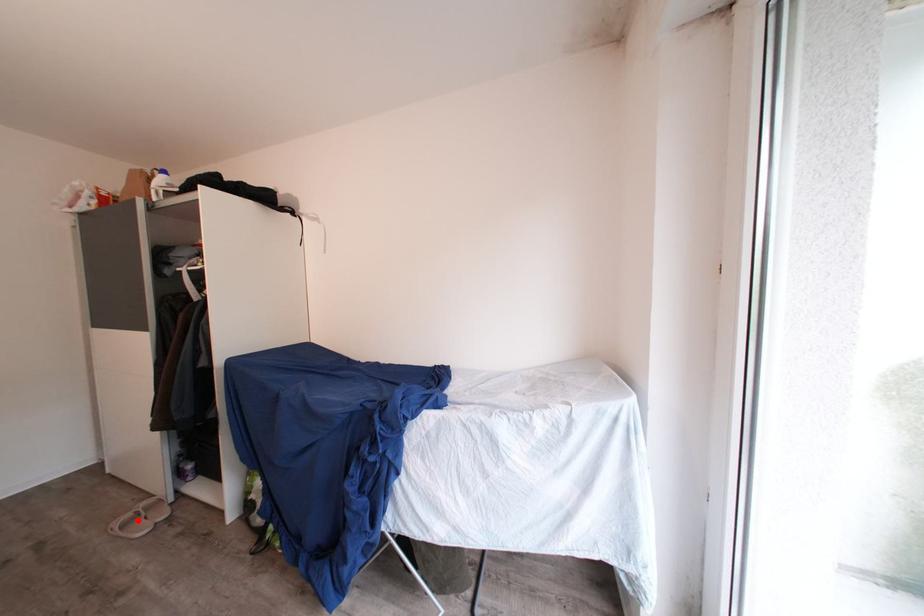
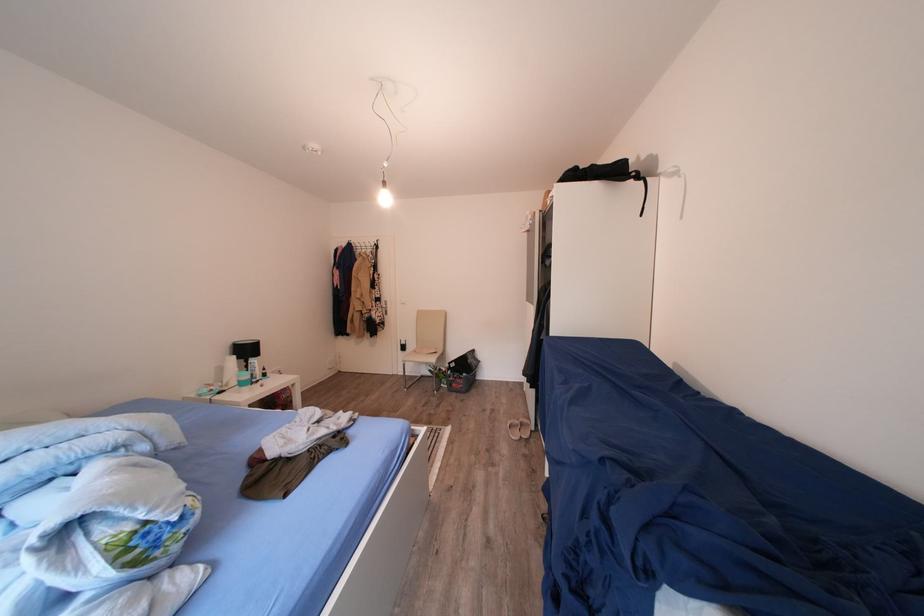
The point at the highlighted location is marked in the first image. Where is the corresponding point in the second image?

(526, 427)